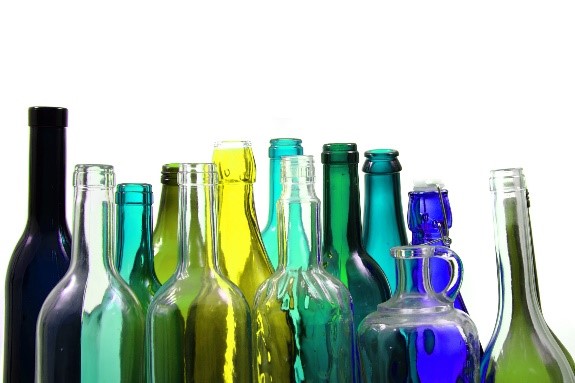
At what (x,y) coordinates should I click in order to perform the action: click on colored wine beakers. Please return your answer as a coordinate pair (x, y). The height and width of the screenshot is (383, 575). Looking at the image, I should click on (26, 246), (130, 243), (159, 242), (231, 220), (269, 241), (342, 229), (383, 220), (428, 220).